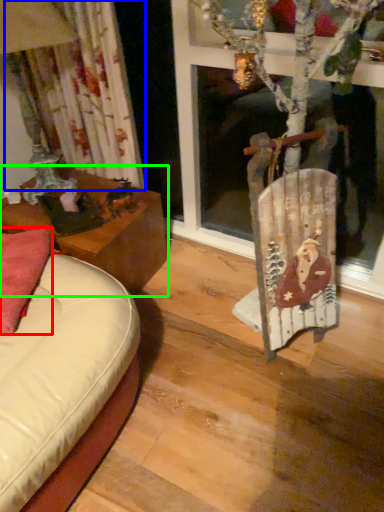
Question: Based on their relative distances, which object is nearer to pillow (highlighted by a red box)? Choose from curtain (highlighted by a blue box) and table (highlighted by a green box).

Choices:
 (A) curtain
 (B) table

Answer: (B)